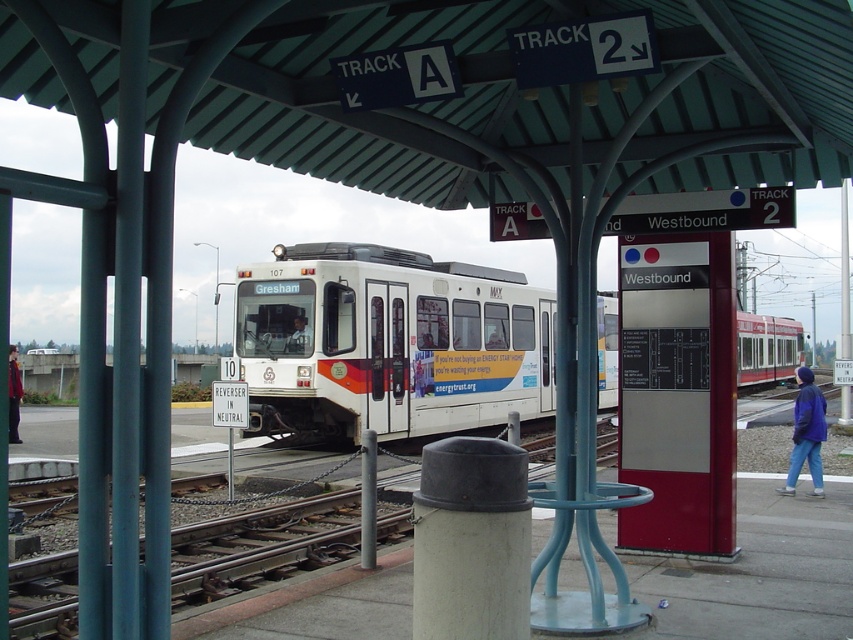
In the scene shown: You are a janitor assigned to clean the train station platform. You need to place a new trash can that is 1.2 meters wide. The current white matte trash can at center is in the way of the new one. Can you replace it with the new trash can without moving the blue denim jacket at lower right?

The white matte trash can at center is thinner than the blue denim jacket at lower right. Since the new trash can is 1.2 meters wide and the existing trash can is thinner, it might be possible to replace it, but you must ensure that the blue denim jacket at lower right is not in the way. However, since the description states the jacket is at lower right, and the trash can is at center, there might be enough space if the new trash can is placed in the same central position, provided the jacket isn

You are a passenger waiting at the train station platform. You notice a white glossy train at center and a red jacket at lower left. Which object takes up more horizontal space from left to right?

The white glossy train at center takes up more horizontal space than the red jacket at lower left because its width surpasses the jacket.

You are a passenger waiting on the platform and see the red jacket at lower left and the matte black train at center. Which object is taller from your viewpoint?

The red jacket at lower left is taller than the matte black train at center.